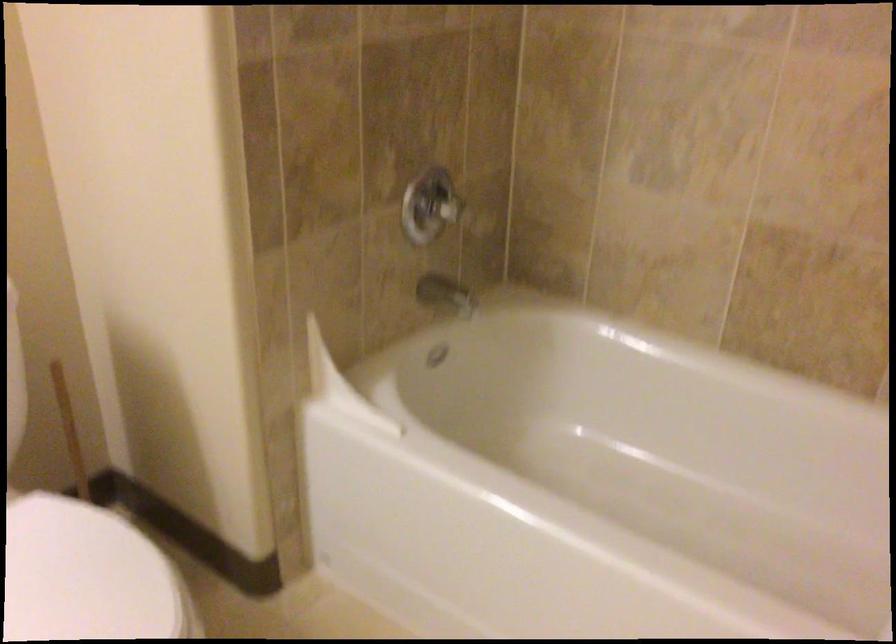
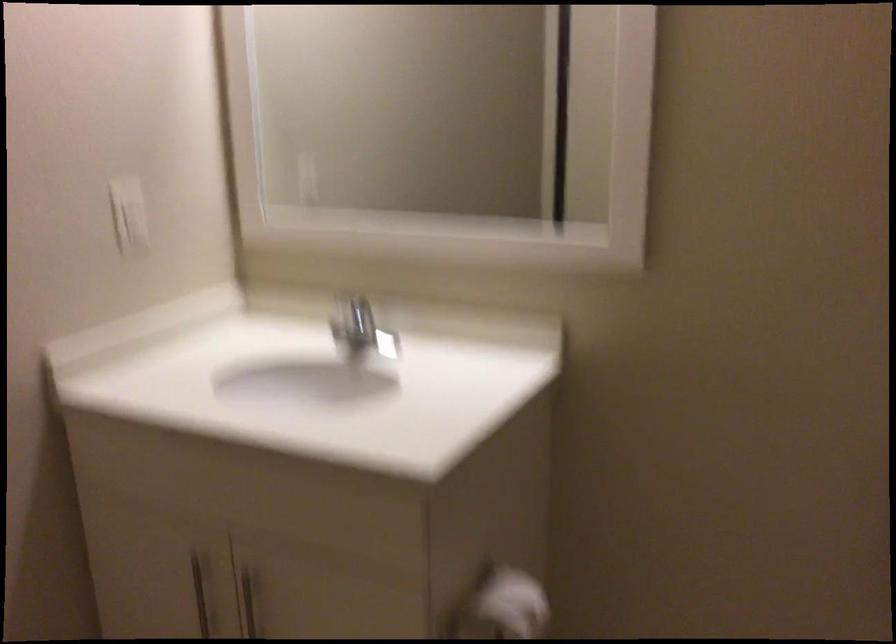
Question: How did the camera likely rotate?

Choices:
 (A) Left
 (B) Right
 (C) Up
 (D) Down

Answer: (A)